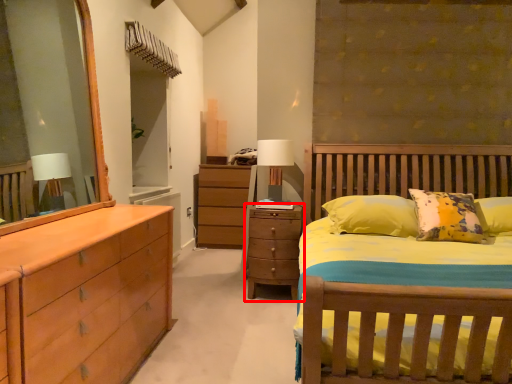
Question: From the image's perspective, considering the relative positions of chest of drawers (annotated by the red box) and table lamp in the image provided, where is chest of drawers (annotated by the red box) located with respect to the staircase?

Choices:
 (A) above
 (B) below

Answer: (B)